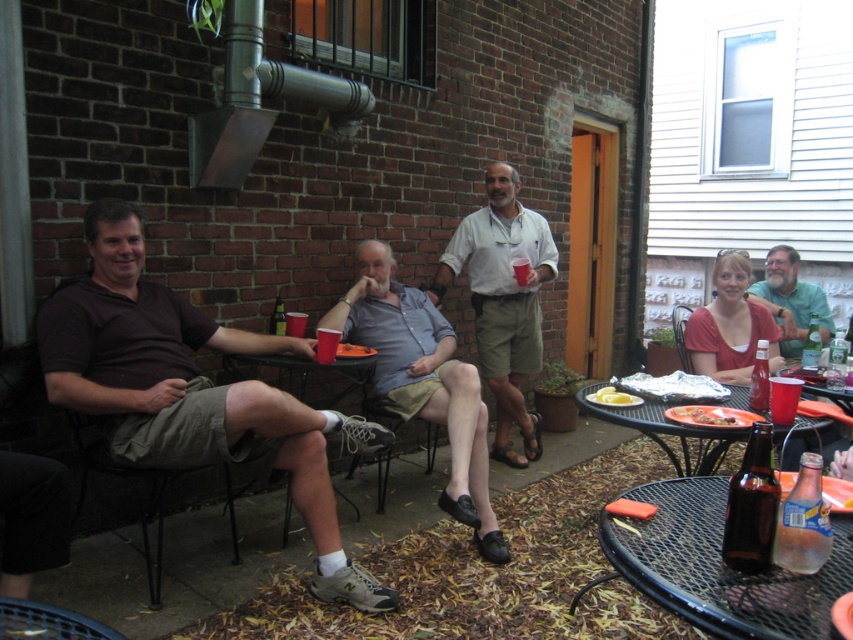
Between brown glass bottle at lower right and metallic silver tray at lower right, which one is positioned higher?

brown glass bottle at lower right is higher up.

Identify the location of brown glass bottle at lower right. (751, 506).

Who is more forward, (747, 561) or (822, 429)?

Point (747, 561) is in front.

At what (x,y) coordinates should I click in order to perform the action: click on brown glass bottle at lower right. Please return your answer as a coordinate pair (x, y). The width and height of the screenshot is (853, 640). Looking at the image, I should click on (751, 506).

Is brown fabric chair at lower left bigger than orange plastic plate at lower right?

Incorrect, brown fabric chair at lower left is not larger than orange plastic plate at lower right.

Is brown fabric chair at lower left behind orange plastic plate at lower right?

Yes, it is.

At what (x,y) coordinates should I click in order to perform the action: click on brown fabric chair at lower left. Please return your answer as a coordinate pair (x, y). Image resolution: width=853 pixels, height=640 pixels. Looking at the image, I should click on (131, 486).

Does green matte shirt at upper right have a greater height compared to red plastic cup at center?

Yes, green matte shirt at upper right is taller than red plastic cup at center.

Is green matte shirt at upper right shorter than red plastic cup at center?

Incorrect, green matte shirt at upper right's height does not fall short of red plastic cup at center's.

Describe the element at coordinates (791, 300) in the screenshot. This screenshot has width=853, height=640. I see `green matte shirt at upper right` at that location.

The width and height of the screenshot is (853, 640). What are the coordinates of `green matte shirt at upper right` in the screenshot? It's located at (791, 300).